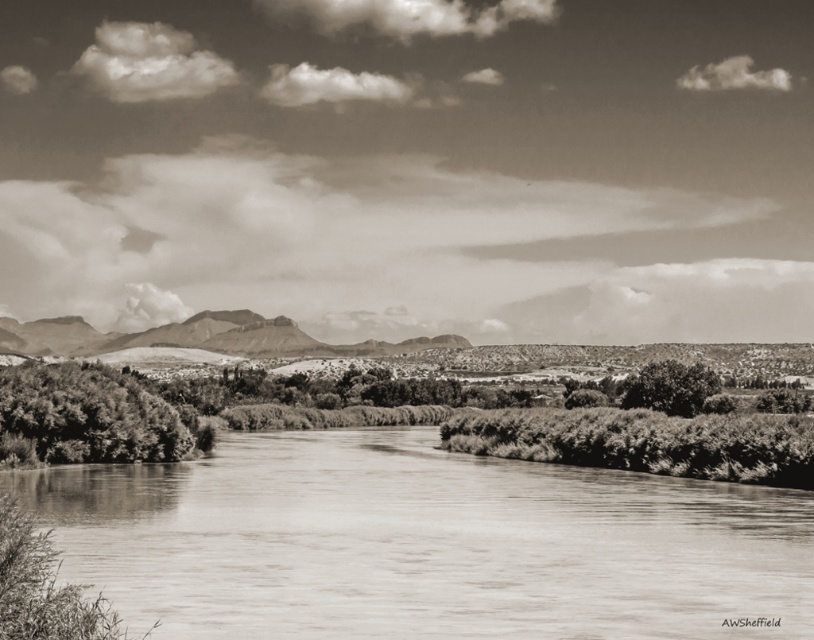
Is the position of smooth water at center more distant than that of grainy textured bush at right?

No, smooth water at center is in front of grainy textured bush at right.

Image resolution: width=814 pixels, height=640 pixels. Identify the location of smooth water at center. (423, 544).

Between point (410, 502) and point (685, 371), which one is positioned behind?

Positioned behind is point (685, 371).

Locate an element on the screen. smooth water at center is located at coordinates (423, 544).

Locate an element on the screen. smooth water at center is located at coordinates (423, 544).

Where is `smooth water at center`? The width and height of the screenshot is (814, 640). smooth water at center is located at coordinates (423, 544).

Can you confirm if thick foliage at left is shorter than rugged stone mountain at center?

Correct, thick foliage at left is not as tall as rugged stone mountain at center.

Measure the distance between point (95, 408) and camera.

They are 276.75 feet apart.

Between point (68, 420) and point (221, 340), which one is positioned in front?

Point (68, 420) is more forward.

The height and width of the screenshot is (640, 814). I want to click on thick foliage at left, so click(82, 417).